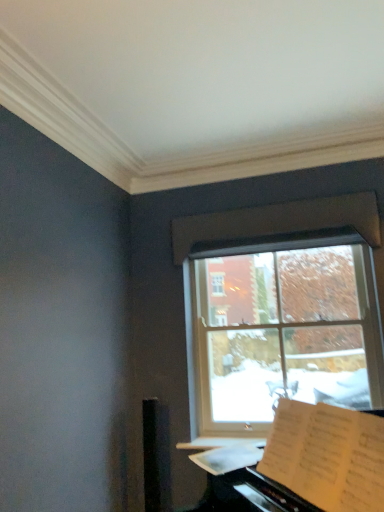
Question: In terms of size, does white paper at lower right appear bigger or smaller than white paper sheet music at lower right?

Choices:
 (A) small
 (B) big

Answer: (B)

Question: From a real-world perspective, is white paper at lower right positioned above or below white paper sheet music at lower right?

Choices:
 (A) below
 (B) above

Answer: (A)

Question: Which object is positioned closest to the clear glass window at center?

Choices:
 (A) white paper sheet music at lower right
 (B) white paper at lower right

Answer: (A)

Question: Based on their relative distances, which object is farther from the clear glass window at center?

Choices:
 (A) white paper at lower right
 (B) white paper sheet music at lower right

Answer: (A)